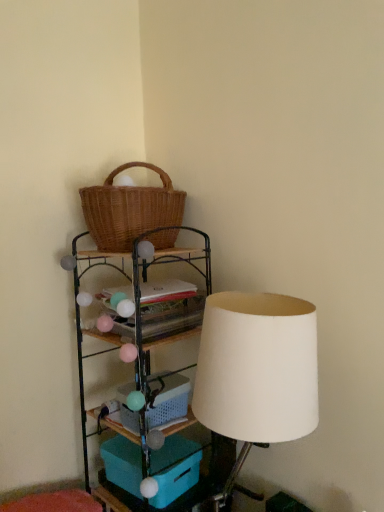
Measure the distance between woven brown picnic basket at upper left and camera.

The depth of woven brown picnic basket at upper left is 1.46 meters.

Image resolution: width=384 pixels, height=512 pixels. What do you see at coordinates (208, 475) in the screenshot?
I see `woven wood shelf at upper left` at bounding box center [208, 475].

Image resolution: width=384 pixels, height=512 pixels. What do you see at coordinates (169, 402) in the screenshot? I see `plastic/mesh basket at lower center` at bounding box center [169, 402].

Measure the distance between white matte lampshade at right and camera.

white matte lampshade at right and camera are 39.28 inches apart.

Identify the location of woven brown picnic basket at upper left. The image size is (384, 512). (129, 210).

Does woven wood shelf at upper left have a lesser height compared to plastic/mesh basket at lower center?

No.

Identify the location of basket to the right of woven wood shelf at upper left. Image resolution: width=384 pixels, height=512 pixels. (169, 402).

Which is closer to the camera, (227,445) or (170,408)?

The point (170,408) is in front.

From the image's perspective, is woven wood shelf at upper left under plastic/mesh basket at lower center?

Yes, from the image's perspective, woven wood shelf at upper left is below plastic/mesh basket at lower center.

Relative to white matte lampshade at right, is teal plastic storage box at lower center in front or behind?

Clearly, teal plastic storage box at lower center is behind white matte lampshade at right.

Identify the location of table lamp lying in front of the teal plastic storage box at lower center. The height and width of the screenshot is (512, 384). (256, 371).

Looking at this image, is teal plastic storage box at lower center next to white matte lampshade at right and touching it?

No, teal plastic storage box at lower center is not in contact with white matte lampshade at right.

Considering the relative sizes of plastic/mesh basket at lower center and teal plastic storage box at lower center in the image provided, is plastic/mesh basket at lower center bigger than teal plastic storage box at lower center?

No, plastic/mesh basket at lower center is not bigger than teal plastic storage box at lower center.

Is plastic/mesh basket at lower center oriented towards teal plastic storage box at lower center?

No.

Is teal plastic storage box at lower center located within plastic/mesh basket at lower center?

No, teal plastic storage box at lower center is located outside of plastic/mesh basket at lower center.

Based on the photo, can you tell me how much plastic/mesh basket at lower center and teal plastic storage box at lower center differ in facing direction?

The angular difference between plastic/mesh basket at lower center and teal plastic storage box at lower center is 0.909 degrees.

Considering the relative sizes of woven wood shelf at upper left and woven brown picnic basket at upper left in the image provided, is woven wood shelf at upper left wider than woven brown picnic basket at upper left?

In fact, woven wood shelf at upper left might be narrower than woven brown picnic basket at upper left.

Who is bigger, woven wood shelf at upper left or woven brown picnic basket at upper left?

With larger size is woven wood shelf at upper left.

Is woven wood shelf at upper left not close to woven brown picnic basket at upper left?

Actually, woven wood shelf at upper left and woven brown picnic basket at upper left are a little close together.

Is woven wood shelf at upper left behind woven brown picnic basket at upper left?

No, it is not.

Are white matte lampshade at right and plastic/mesh basket at lower center far apart?

Actually, white matte lampshade at right and plastic/mesh basket at lower center are a little close together.

From a real-world perspective, who is located higher, white matte lampshade at right or plastic/mesh basket at lower center?

white matte lampshade at right.

Is the position of white matte lampshade at right less distant than that of plastic/mesh basket at lower center?

Yes.

From the image's perspective, is white matte lampshade at right on top of plastic/mesh basket at lower center?

Yes, from the image's perspective, white matte lampshade at right is over plastic/mesh basket at lower center.

Looking at their sizes, would you say woven brown picnic basket at upper left is wider or thinner than woven wood shelf at upper left?

woven brown picnic basket at upper left is wider than woven wood shelf at upper left.

From the image's perspective, is woven brown picnic basket at upper left below woven wood shelf at upper left?

Incorrect, from the image's perspective, woven brown picnic basket at upper left is higher than woven wood shelf at upper left.

This screenshot has height=512, width=384. What are the coordinates of `shelf on the right of woven brown picnic basket at upper left` in the screenshot? It's located at click(x=208, y=475).

Between woven brown picnic basket at upper left and woven wood shelf at upper left, which one has smaller size?

woven brown picnic basket at upper left is smaller.

How many degrees apart are the facing directions of woven brown picnic basket at upper left and white matte lampshade at right?

They differ by 6.96 degrees in their facing directions.

From a real-world perspective, which is physically below, woven brown picnic basket at upper left or white matte lampshade at right?

white matte lampshade at right, from a real-world perspective.

Identify the location of table lamp below the woven brown picnic basket at upper left (from the image's perspective). Image resolution: width=384 pixels, height=512 pixels. (256, 371).

Considering the positions of objects woven brown picnic basket at upper left and white matte lampshade at right in the image provided, who is more to the right, woven brown picnic basket at upper left or white matte lampshade at right?

white matte lampshade at right is more to the right.

At what (x,y) coordinates should I click in order to perform the action: click on basket above the woven wood shelf at upper left (from the image's perspective). Please return your answer as a coordinate pair (x, y). Looking at the image, I should click on (169, 402).

You are a GUI agent. You are given a task and a screenshot of the screen. Output one action in this format:
    pyautogui.click(x=<x>, y=<y>)
    Task: Click on the table lamp that is on the right side of teal plastic storage box at lower center
    
    Given the screenshot: What is the action you would take?
    pyautogui.click(x=256, y=371)

Which object lies further to the anchor point white matte lampshade at right, plastic/mesh basket at lower center or teal plastic storage box at lower center?

Among the two, teal plastic storage box at lower center is located further to white matte lampshade at right.

Estimate the real-world distances between objects in this image. Which object is further from woven brown picnic basket at upper left, plastic/mesh basket at lower center or teal plastic storage box at lower center?

teal plastic storage box at lower center lies further to woven brown picnic basket at upper left than the other object.

Estimate the real-world distances between objects in this image. Which object is further from woven brown picnic basket at upper left, teal plastic storage box at lower center or woven wood shelf at upper left?

Among the two, teal plastic storage box at lower center is located further to woven brown picnic basket at upper left.

When comparing their distances from plastic/mesh basket at lower center, does woven brown picnic basket at upper left or white matte lampshade at right seem further?

woven brown picnic basket at upper left.

Estimate the real-world distances between objects in this image. Which object is further from woven brown picnic basket at upper left, woven wood shelf at upper left or teal plastic storage box at lower center?

Among the two, teal plastic storage box at lower center is located further to woven brown picnic basket at upper left.

Estimate the real-world distances between objects in this image. Which object is closer to white matte lampshade at right, woven brown picnic basket at upper left or plastic/mesh basket at lower center?

Among the two, plastic/mesh basket at lower center is located nearer to white matte lampshade at right.

Which object lies further to the anchor point woven brown picnic basket at upper left, woven wood shelf at upper left or white matte lampshade at right?

white matte lampshade at right is positioned further to the anchor woven brown picnic basket at upper left.

Estimate the real-world distances between objects in this image. Which object is further from white matte lampshade at right, woven wood shelf at upper left or teal plastic storage box at lower center?

teal plastic storage box at lower center lies further to white matte lampshade at right than the other object.

Where is `table lamp between woven brown picnic basket at upper left and woven wood shelf at upper left in the vertical direction`? table lamp between woven brown picnic basket at upper left and woven wood shelf at upper left in the vertical direction is located at coordinates (256, 371).

Find the location of a particular element. The width and height of the screenshot is (384, 512). shelf between white matte lampshade at right and teal plastic storage box at lower center along the z-axis is located at coordinates [x=208, y=475].

This screenshot has height=512, width=384. I want to click on shelf between woven brown picnic basket at upper left and teal plastic storage box at lower center in the up-down direction, so click(x=208, y=475).

Image resolution: width=384 pixels, height=512 pixels. What are the coordinates of `table lamp between woven brown picnic basket at upper left and teal plastic storage box at lower center from top to bottom` in the screenshot? It's located at (256, 371).